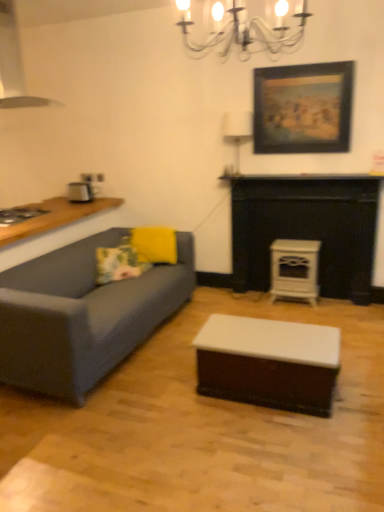
Find the location of `vacant space situated above wooden framed painting at upper right (from a real-world perspective)`. vacant space situated above wooden framed painting at upper right (from a real-world perspective) is located at coordinates (322, 56).